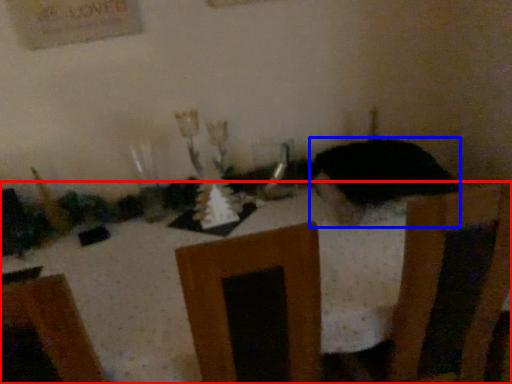
Question: Which of the following is the farthest to the observer, furniture (highlighted by a red box) or animal (highlighted by a blue box)?

Choices:
 (A) furniture
 (B) animal

Answer: (B)